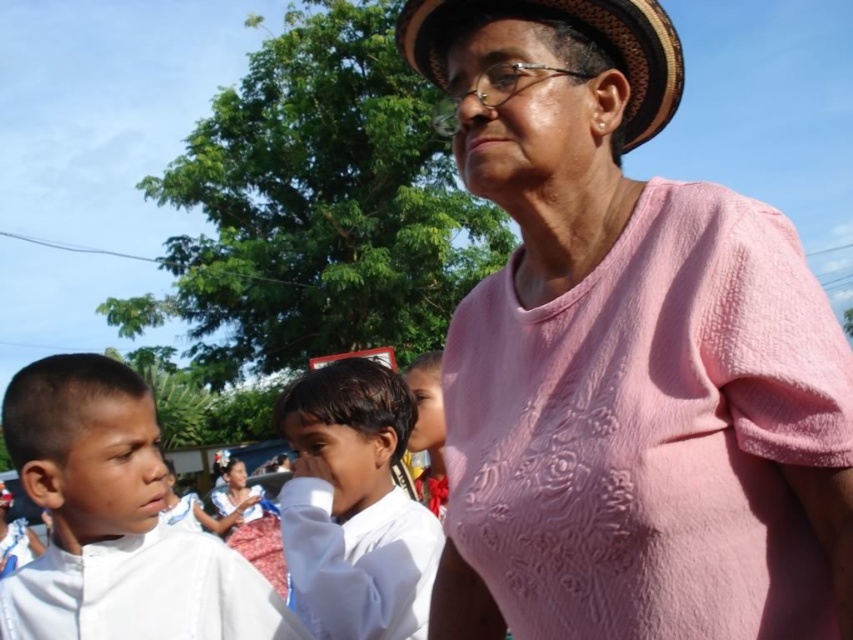
You are a photographer trying to capture a group photo. You notice the white cotton shirt at left and the woven straw hat at upper center in your frame. Which object should you adjust to ensure both are fully visible in the photo?

The white cotton shirt at left is taller than the woven straw hat at upper center. To ensure both are fully visible, you should lower the camera angle slightly to accommodate the height of the white cotton shirt at left.

You are standing at the center of the image and want to hand a leaflet to the person wearing the white cotton shirt at left. In which direction should you move to reach them?

The white cotton shirt at left is located at point (x=115, y=522), so you should move to the left and slightly downward from your current position at the center to reach them.